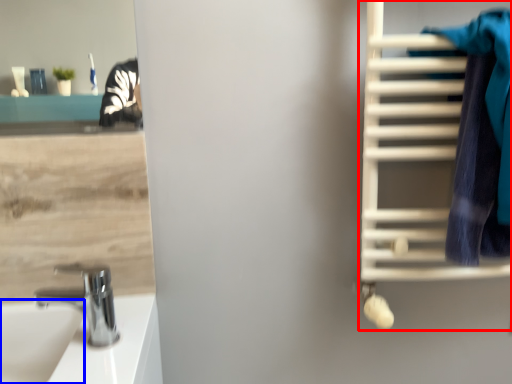
Question: Which object appears closest to the camera in this image, bunk bed (highlighted by a red box) or sink (highlighted by a blue box)?

Choices:
 (A) bunk bed
 (B) sink

Answer: (B)